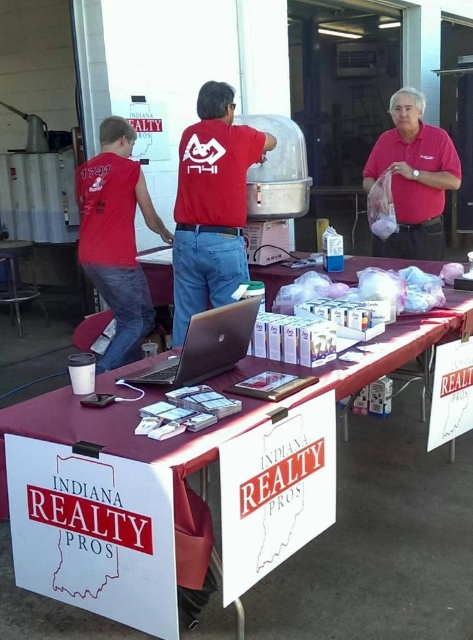
Is point (309, 557) behind point (251, 320)?

Yes, point (309, 557) is behind point (251, 320).

Is maroon fabric table at center smaller than silver metallic laptop at center?

No, maroon fabric table at center is not smaller than silver metallic laptop at center.

Between point (361, 579) and point (254, 305), which one is positioned in front?

Point (254, 305) is more forward.

Locate an element on the screen. The width and height of the screenshot is (473, 640). maroon fabric table at center is located at coordinates (382, 541).

Does maroon fabric table at center have a greater width compared to matte red shirt at left?

Indeed, maroon fabric table at center has a greater width compared to matte red shirt at left.

Is maroon fabric table at center shorter than matte red shirt at left?

Indeed, maroon fabric table at center has a lesser height compared to matte red shirt at left.

Between point (397, 449) and point (114, 147), which one is positioned in front?

Positioned in front is point (397, 449).

Locate an element on the screen. The image size is (473, 640). maroon fabric table at center is located at coordinates (382, 541).

Describe the element at coordinates (211, 205) in the screenshot. I see `matte red shirt at center` at that location.

Between matte red shirt at center and matte red shirt at upper right, which one is positioned lower?

matte red shirt at center is below.

You are a GUI agent. You are given a task and a screenshot of the screen. Output one action in this format:
    pyautogui.click(x=<x>, y=<y>)
    Task: Click on the matte red shirt at center
    Image resolution: width=473 pixels, height=640 pixels.
    Given the screenshot: What is the action you would take?
    pyautogui.click(x=211, y=205)